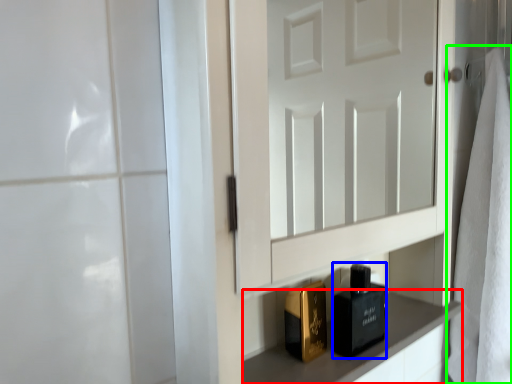
Question: Which is nearer to the cabinetry (highlighted by a red box)? perfume (highlighted by a blue box) or bath towel (highlighted by a green box).

Choices:
 (A) perfume
 (B) bath towel

Answer: (A)